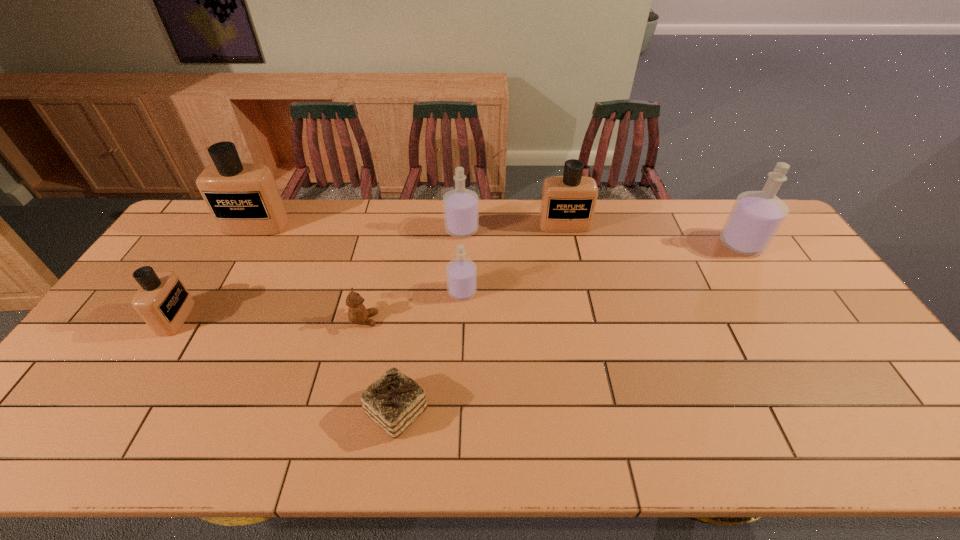
The image size is (960, 540). I want to click on free space between the biggest purple perfume and the second smallest purple perfume, so click(602, 237).

Locate an element on the screen. Image resolution: width=960 pixels, height=540 pixels. free area in between the chocolate cake and the smallest purple perfume is located at coordinates (429, 351).

Find the location of a particular element. The height and width of the screenshot is (540, 960). free point between the nearest purple perfume and the biggest beige perfume is located at coordinates (359, 259).

I want to click on empty space between the second smallest purple perfume and the biggest beige perfume, so click(359, 227).

This screenshot has height=540, width=960. I want to click on vacant region between the biggest purple perfume and the seventh object from left to right, so click(x=653, y=234).

I want to click on the seventh closest object to the nearest object, so click(756, 216).

Where is `object that can be found as the second closest to the seventh object from left to right`? The image size is (960, 540). object that can be found as the second closest to the seventh object from left to right is located at coordinates (461, 273).

Select which perfume is the closest to the fifth object from right to left. Please provide its 2D coordinates. Your answer should be formatted as a tuple, i.e. [(x, y)], where the tuple contains the x and y coordinates of a point satisfying the conditions above.

[(461, 273)]

What are the coordinates of `perfume that stands as the fifth closest to the fifth object from right to left` in the screenshot? It's located at (243, 198).

Identify which purple perfume is the third closest to the seventh object from left to right. Please provide its 2D coordinates. Your answer should be formatted as a tuple, i.e. [(x, y)], where the tuple contains the x and y coordinates of a point satisfying the conditions above.

[(756, 216)]